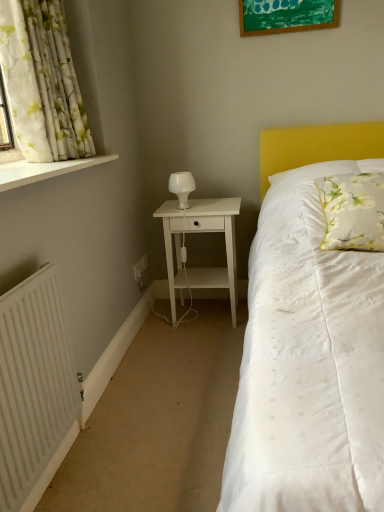
Locate an element on the screen. This screenshot has height=512, width=384. vacant point to the right of white frosted glass table lamp at center is located at coordinates (217, 202).